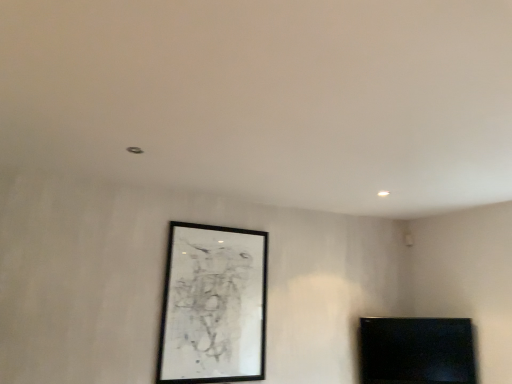
What do you see at coordinates (213, 305) in the screenshot? I see `black matte picture frame at center` at bounding box center [213, 305].

Find the location of `black matte picture frame at center`. black matte picture frame at center is located at coordinates (213, 305).

You are a GUI agent. You are given a task and a screenshot of the screen. Output one action in this format:
    pyautogui.click(x=<x>, y=<y>)
    Task: Click on the black glossy tv at lower right
    
    Given the screenshot: What is the action you would take?
    pyautogui.click(x=417, y=351)

This screenshot has width=512, height=384. What do you see at coordinates (417, 351) in the screenshot? I see `black glossy tv at lower right` at bounding box center [417, 351].

Image resolution: width=512 pixels, height=384 pixels. Identify the location of black matte picture frame at center. (213, 305).

Considering the relative positions of black glossy tv at lower right and black matte picture frame at center in the image provided, is black glossy tv at lower right to the left or to the right of black matte picture frame at center?

From the image, it's evident that black glossy tv at lower right is to the right of black matte picture frame at center.

Is the depth of black glossy tv at lower right less than that of black matte picture frame at center?

No, black glossy tv at lower right is behind black matte picture frame at center.

Which point is more distant from viewer, (362, 359) or (218, 243)?

The point (362, 359) is farther from the camera.

From the image's perspective, which one is positioned lower, black glossy tv at lower right or black matte picture frame at center?

From the image's view, black glossy tv at lower right is below.

From a real-world perspective, which is physically below, black glossy tv at lower right or black matte picture frame at center?

From a 3D spatial view, black glossy tv at lower right is below.

Which object is wider, black glossy tv at lower right or black matte picture frame at center?

With larger width is black glossy tv at lower right.

Who is taller, black glossy tv at lower right or black matte picture frame at center?

black matte picture frame at center.

Can you confirm if black glossy tv at lower right is bigger than black matte picture frame at center?

Actually, black glossy tv at lower right might be smaller than black matte picture frame at center.

Is black matte picture frame at center located within black glossy tv at lower right?

No, black glossy tv at lower right does not contain black matte picture frame at center.

Would you say black glossy tv at lower right is a long distance from black matte picture frame at center?

That's right, there is a large distance between black glossy tv at lower right and black matte picture frame at center.

Is black glossy tv at lower right turned away from black matte picture frame at center?

No, black matte picture frame at center is not at the back of black glossy tv at lower right.

This screenshot has height=384, width=512. I want to click on picture frame on the left of black glossy tv at lower right, so click(213, 305).

Considering the positions of objects black matte picture frame at center and black glossy tv at lower right in the image provided, who is more to the right, black matte picture frame at center or black glossy tv at lower right?

black glossy tv at lower right.

Does black matte picture frame at center come in front of black glossy tv at lower right?

Yes.

Is point (161, 383) in front of point (380, 352)?

Yes, point (161, 383) is closer to viewer.

From the image's perspective, is black matte picture frame at center below black glossy tv at lower right?

No, from the image's perspective, black matte picture frame at center is not beneath black glossy tv at lower right.

From a real-world perspective, who is located lower, black matte picture frame at center or black glossy tv at lower right?

black glossy tv at lower right, from a real-world perspective.

Is black matte picture frame at center wider or thinner than black glossy tv at lower right?

In the image, black matte picture frame at center appears to be more narrow than black glossy tv at lower right.

Based on the photo, from their relative heights in the image, would you say black matte picture frame at center is taller or shorter than black glossy tv at lower right?

black matte picture frame at center is taller than black glossy tv at lower right.

Is black matte picture frame at center smaller than black glossy tv at lower right?

No, black matte picture frame at center is not smaller than black glossy tv at lower right.

Is black glossy tv at lower right a part of black matte picture frame at center?

Actually, black glossy tv at lower right is outside black matte picture frame at center.

Is black matte picture frame at center in contact with black glossy tv at lower right?

No, black matte picture frame at center is not touching black glossy tv at lower right.

Could you tell me if black matte picture frame at center is facing black glossy tv at lower right?

No, black matte picture frame at center is not turned towards black glossy tv at lower right.

Can you tell me how much black matte picture frame at center and black glossy tv at lower right differ in facing direction?

black matte picture frame at center and black glossy tv at lower right are facing 38.8 degrees away from each other.

You are a GUI agent. You are given a task and a screenshot of the screen. Output one action in this format:
    pyautogui.click(x=<x>, y=<y>)
    Task: Click on the picture frame located above the black glossy tv at lower right (from the image's perspective)
    Image resolution: width=512 pixels, height=384 pixels.
    Given the screenshot: What is the action you would take?
    pyautogui.click(x=213, y=305)

Locate an element on the screen. This screenshot has width=512, height=384. furniture behind the black matte picture frame at center is located at coordinates pyautogui.click(x=417, y=351).

The height and width of the screenshot is (384, 512). Find the location of `picture frame above the black glossy tv at lower right (from the image's perspective)`. picture frame above the black glossy tv at lower right (from the image's perspective) is located at coordinates pos(213,305).